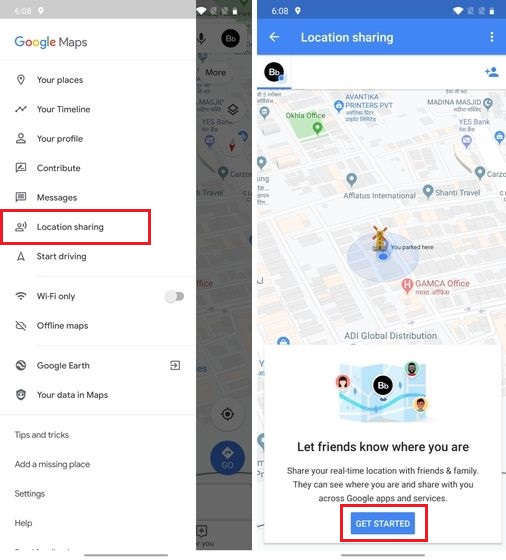
In order to click on on/off switch in this screenshot , I will do `click(178, 295)`.